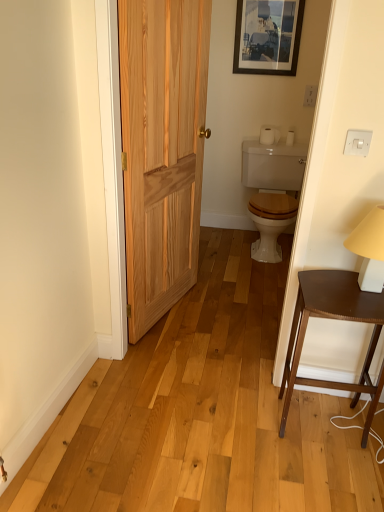
You are a GUI agent. You are given a task and a screenshot of the screen. Output one action in this format:
    pyautogui.click(x=<x>, y=<y>)
    Task: Click on the vacant space to the right of natural wood door at left
    
    Given the screenshot: What is the action you would take?
    pyautogui.click(x=207, y=318)